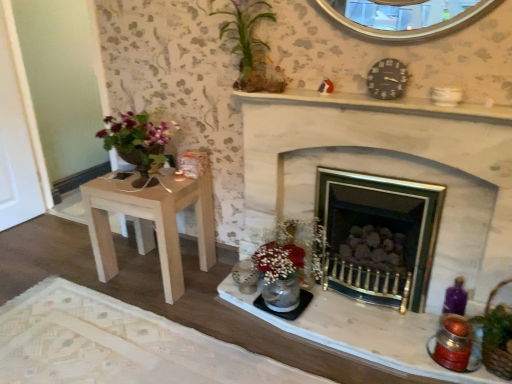
You are a GUI agent. You are given a task and a screenshot of the screen. Output one action in this format:
    pyautogui.click(x=<x>, y=<y>)
    Task: Click on the vacant space behind shiny metallic candle holder at lower right, the second candle holder from the left
    
    Given the screenshot: What is the action you would take?
    pyautogui.click(x=413, y=319)